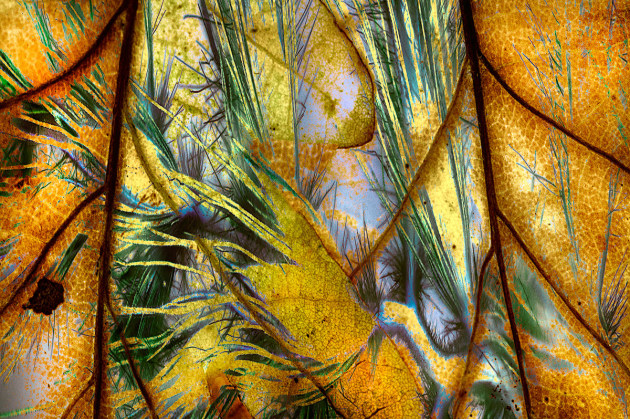
Where is `abstract art`? abstract art is located at coordinates (408, 201).